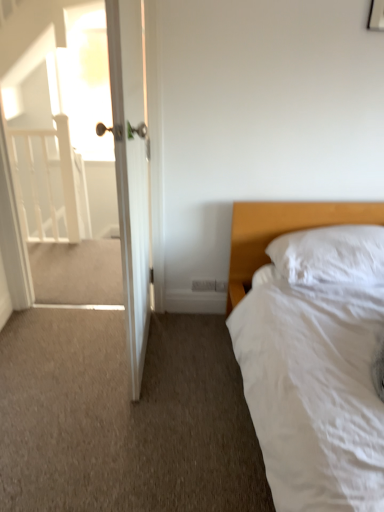
Image resolution: width=384 pixels, height=512 pixels. Identify the location of free space in front of white wooden door at left. (124, 416).